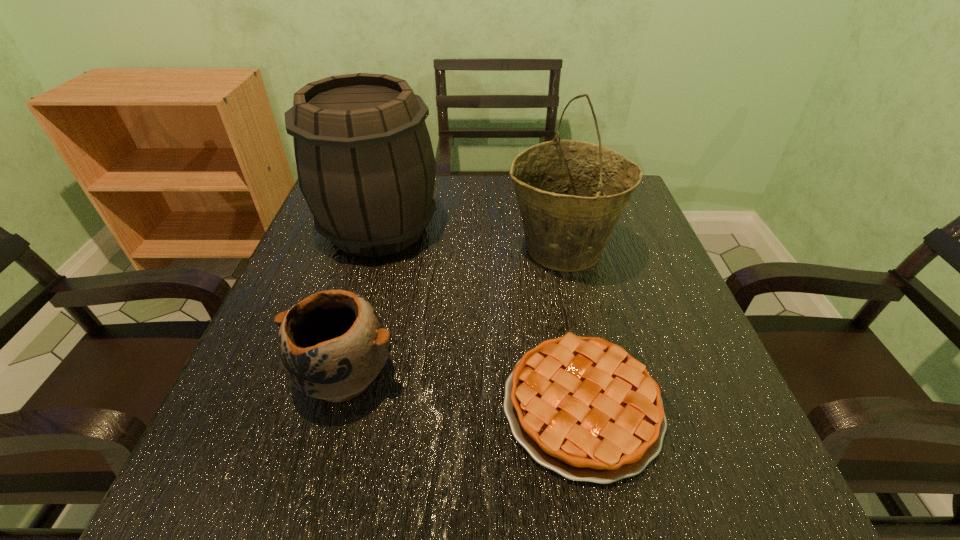
I want to click on object that can be found as the second closest to the left wine bucket, so click(x=332, y=344).

Where is `object that is the third closest to the right wine bucket`? object that is the third closest to the right wine bucket is located at coordinates [x=332, y=344].

Where is `free location that satisfies the following two spatial constraints: 1. on the front side of the left wine bucket; 2. on the left side of the pottery`? free location that satisfies the following two spatial constraints: 1. on the front side of the left wine bucket; 2. on the left side of the pottery is located at coordinates (336, 375).

Identify the location of free location that satisfies the following two spatial constraints: 1. on the back side of the right wine bucket; 2. on the left side of the pottery. (379, 249).